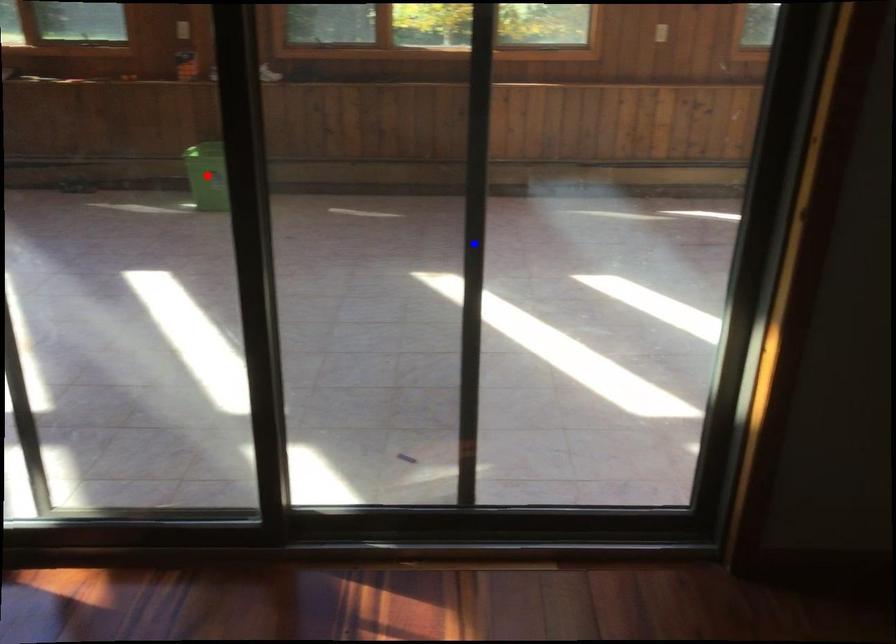
Question: Two points are marked on the image. Which point is closer to the camera?

Choices:
 (A) Blue point is closer.
 (B) Red point is closer.

Answer: (B)